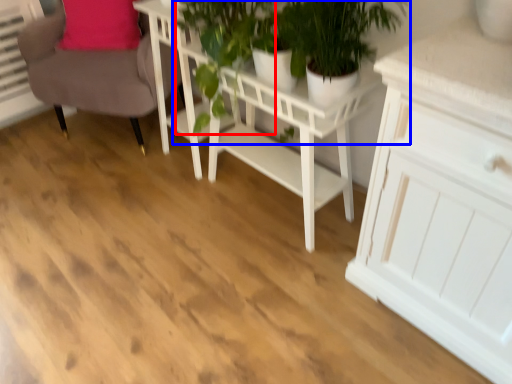
Question: Which object is closer to the camera taking this photo, plant (highlighted by a red box) or houseplant (highlighted by a blue box)?

Choices:
 (A) plant
 (B) houseplant

Answer: (B)